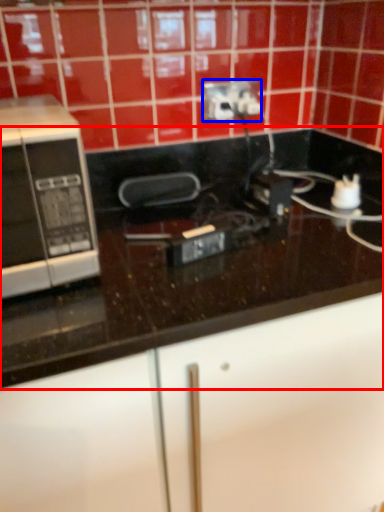
Question: Among these objects, which one is nearest to the camera, countertop (highlighted by a red box) or power plugs and sockets (highlighted by a blue box)?

Choices:
 (A) countertop
 (B) power plugs and sockets

Answer: (A)